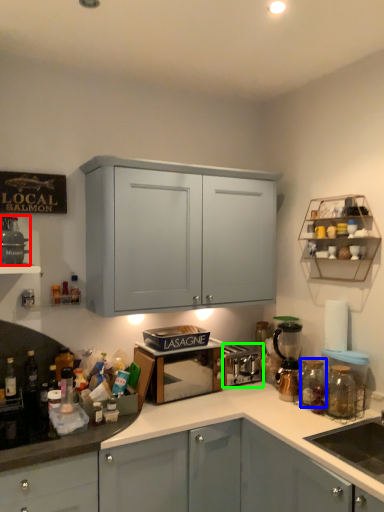
Question: Estimate the real-world distances between objects in this image. Which object is farther from appliance (highlighted by a red box), glass jar (highlighted by a blue box) or appliance (highlighted by a green box)?

Choices:
 (A) glass jar
 (B) appliance

Answer: (A)